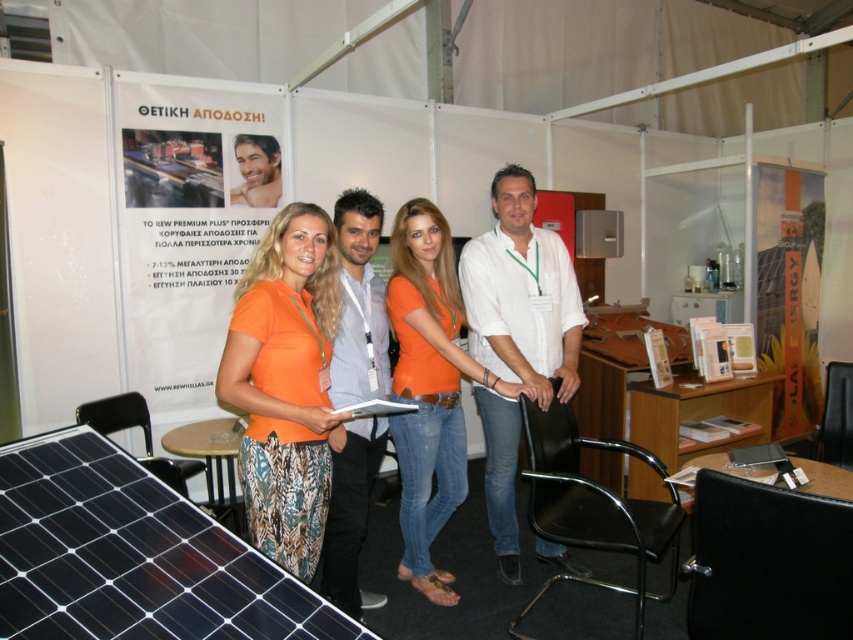
Who is lower down, orange fabric skirt at center or orange cotton t-shirt at center?

orange cotton t-shirt at center is lower down.

Locate an element on the screen. orange fabric skirt at center is located at coordinates (285, 384).

Locate an element on the screen. The image size is (853, 640). orange fabric skirt at center is located at coordinates (285, 384).

Describe the element at coordinates (285, 384) in the screenshot. I see `orange fabric skirt at center` at that location.

Between point (286, 451) and point (361, 416), which one is positioned behind?

The point (361, 416) is more distant.

Locate an element on the screen. The height and width of the screenshot is (640, 853). orange fabric skirt at center is located at coordinates (285, 384).

Is orange cotton t-shirt at center above white plastic clipboard at center?

No.

Locate an element on the screen. This screenshot has height=640, width=853. orange cotton t-shirt at center is located at coordinates (428, 387).

Is point (445, 316) positioned before point (413, 403)?

No, (445, 316) is further to viewer.

I want to click on orange cotton t-shirt at center, so click(x=428, y=387).